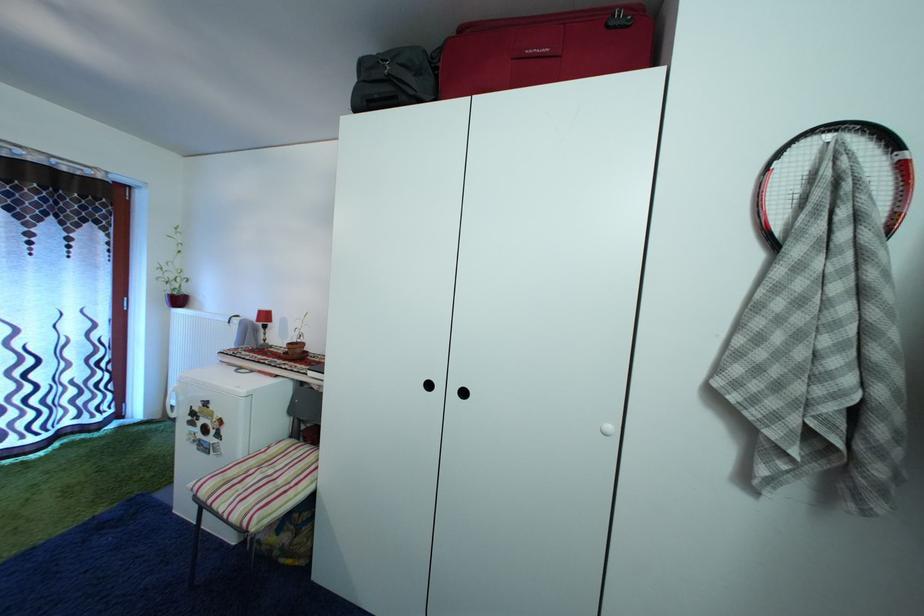
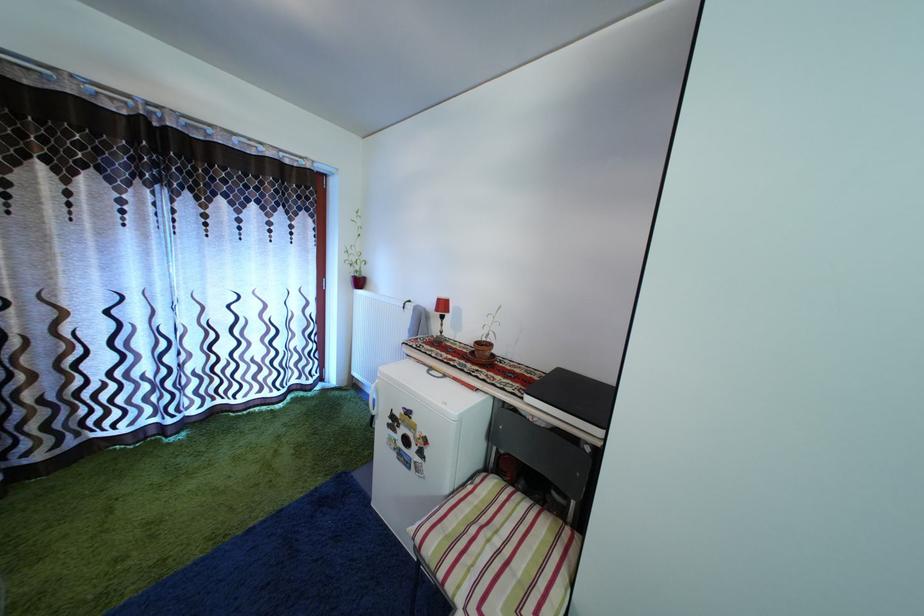
Question: The camera is either moving clockwise (left) or counter-clockwise (right) around the object. The first image is from the beginning of the video and the second image is from the end. Is the camera moving left or right when shooting the video?

Choices:
 (A) Left
 (B) Right

Answer: (B)